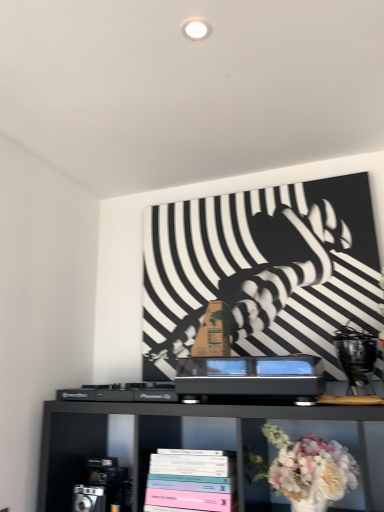
Describe the element at coordinates (311, 467) in the screenshot. This screenshot has height=512, width=384. I see `pastel floral bouquet at lower right` at that location.

The image size is (384, 512). In order to click on pastel floral bouquet at lower right in this screenshot , I will do `click(311, 467)`.

The image size is (384, 512). I want to click on pastel matte books at lower center, so click(x=192, y=479).

Describe the element at coordinates (192, 479) in the screenshot. The width and height of the screenshot is (384, 512). I see `pastel matte books at lower center` at that location.

I want to click on pastel floral bouquet at lower right, so click(x=311, y=467).

Which is more to the right, pastel matte books at lower center or pastel floral bouquet at lower right?

Positioned to the right is pastel floral bouquet at lower right.

Is pastel matte books at lower center further to the viewer compared to pastel floral bouquet at lower right?

Yes, it is.

Considering the points (182, 457) and (281, 438), which point is behind, point (182, 457) or point (281, 438)?

The point (182, 457) is farther from the camera.

From the image's perspective, is pastel matte books at lower center located above or below pastel floral bouquet at lower right?

pastel matte books at lower center is below pastel floral bouquet at lower right.

From a real-world perspective, is pastel matte books at lower center above or below pastel floral bouquet at lower right?

From a real-world perspective, pastel matte books at lower center is physically below pastel floral bouquet at lower right.

Is pastel matte books at lower center wider or thinner than pastel floral bouquet at lower right?

In the image, pastel matte books at lower center appears to be wider than pastel floral bouquet at lower right.

Which of these two, pastel matte books at lower center or pastel floral bouquet at lower right, stands taller?

pastel floral bouquet at lower right is taller.

Considering the sizes of objects pastel matte books at lower center and pastel floral bouquet at lower right in the image provided, who is bigger, pastel matte books at lower center or pastel floral bouquet at lower right?

Bigger between the two is pastel matte books at lower center.

Is pastel matte books at lower center not within pastel floral bouquet at lower right?

Absolutely, pastel matte books at lower center is external to pastel floral bouquet at lower right.

Is pastel matte books at lower center far away from pastel floral bouquet at lower right?

Actually, pastel matte books at lower center and pastel floral bouquet at lower right are a little close together.

Could you tell me if pastel matte books at lower center is facing pastel floral bouquet at lower right?

No, pastel matte books at lower center is not oriented towards pastel floral bouquet at lower right.

Measure the distance from pastel matte books at lower center to pastel floral bouquet at lower right.

A distance of 10.09 inches exists between pastel matte books at lower center and pastel floral bouquet at lower right.

The width and height of the screenshot is (384, 512). In the image, there is a pastel matte books at lower center. In order to click on flower above it (from the image's perspective) in this screenshot , I will do `click(311, 467)`.

Between pastel floral bouquet at lower right and pastel matte books at lower center, which one appears on the right side from the viewer's perspective?

pastel floral bouquet at lower right.

Considering the positions of objects pastel floral bouquet at lower right and pastel matte books at lower center in the image provided, who is in front, pastel floral bouquet at lower right or pastel matte books at lower center?

pastel floral bouquet at lower right is closer to the camera.

Which is closer, (296, 499) or (219, 486)?

Positioned in front is point (296, 499).

From the image's perspective, is pastel floral bouquet at lower right above pastel matte books at lower center?

Yes, from the image's perspective, pastel floral bouquet at lower right is on top of pastel matte books at lower center.

From a real-world perspective, is pastel floral bouquet at lower right located higher than pastel matte books at lower center?

Yes, from a real-world perspective, pastel floral bouquet at lower right is over pastel matte books at lower center

Considering the sizes of objects pastel floral bouquet at lower right and pastel matte books at lower center in the image provided, who is wider, pastel floral bouquet at lower right or pastel matte books at lower center?

With larger width is pastel matte books at lower center.

Is pastel floral bouquet at lower right shorter than pastel matte books at lower center?

In fact, pastel floral bouquet at lower right may be taller than pastel matte books at lower center.

Considering the relative sizes of pastel floral bouquet at lower right and pastel matte books at lower center in the image provided, is pastel floral bouquet at lower right smaller than pastel matte books at lower center?

Correct, pastel floral bouquet at lower right occupies less space than pastel matte books at lower center.

Which is correct: pastel floral bouquet at lower right is inside pastel matte books at lower center, or outside of it?

The correct answer is: outside.

Can you see pastel floral bouquet at lower right touching pastel matte books at lower center?

No, pastel floral bouquet at lower right is not with pastel matte books at lower center.

Is pastel floral bouquet at lower right oriented away from pastel matte books at lower center?

No, pastel floral bouquet at lower right is not facing away from pastel matte books at lower center.

Looking at this image, what's the angular difference between pastel floral bouquet at lower right and pastel matte books at lower center's facing directions?

They differ by 0.239 degrees in their facing directions.

How much distance is there between pastel floral bouquet at lower right and pastel matte books at lower center?

The distance of pastel floral bouquet at lower right from pastel matte books at lower center is 25.63 centimeters.

The image size is (384, 512). Find the location of `flower located above the pastel matte books at lower center (from the image's perspective)`. flower located above the pastel matte books at lower center (from the image's perspective) is located at coordinates (311, 467).

Where is `flower that is in front of the pastel matte books at lower center`? The image size is (384, 512). flower that is in front of the pastel matte books at lower center is located at coordinates (311, 467).

At what (x,y) coordinates should I click in order to perform the action: click on flower that is on the right side of pastel matte books at lower center. Please return your answer as a coordinate pair (x, y). The width and height of the screenshot is (384, 512). Looking at the image, I should click on [x=311, y=467].